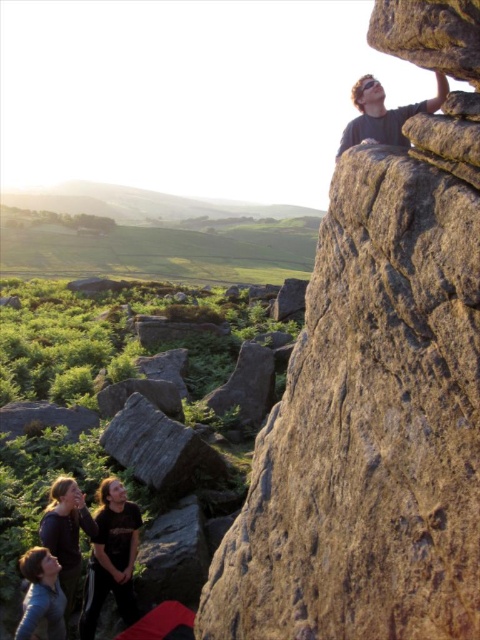
Who is positioned more to the right, dark brown leather jacket at lower left or matte black shirt at upper right?

From the viewer's perspective, matte black shirt at upper right appears more on the right side.

Is dark brown leather jacket at lower left wider than matte black shirt at upper right?

Incorrect, dark brown leather jacket at lower left's width does not surpass matte black shirt at upper right's.

You are a GUI agent. You are given a task and a screenshot of the screen. Output one action in this format:
    pyautogui.click(x=<x>, y=<y>)
    Task: Click on the dark brown leather jacket at lower left
    This screenshot has height=640, width=480.
    Given the screenshot: What is the action you would take?
    pyautogui.click(x=111, y=557)

Between rough textured rock at upper right and dark blue shirt at lower left, which one is positioned lower?

dark blue shirt at lower left is below.

Does rough textured rock at upper right have a lesser height compared to dark blue shirt at lower left?

No, rough textured rock at upper right is not shorter than dark blue shirt at lower left.

This screenshot has width=480, height=640. Describe the element at coordinates (372, 416) in the screenshot. I see `rough textured rock at upper right` at that location.

Where is `rough textured rock at upper right`? rough textured rock at upper right is located at coordinates (372, 416).

Image resolution: width=480 pixels, height=640 pixels. Describe the element at coordinates (67, 532) in the screenshot. I see `dark blue shirt at lower left` at that location.

Who is positioned more to the right, dark blue shirt at lower left or blue denim jacket at lower left?

Positioned to the right is blue denim jacket at lower left.

Measure the distance between point (56, 488) and camera.

Point (56, 488) is 6.43 meters away from camera.

Where is `dark blue shirt at lower left`? dark blue shirt at lower left is located at coordinates (67, 532).